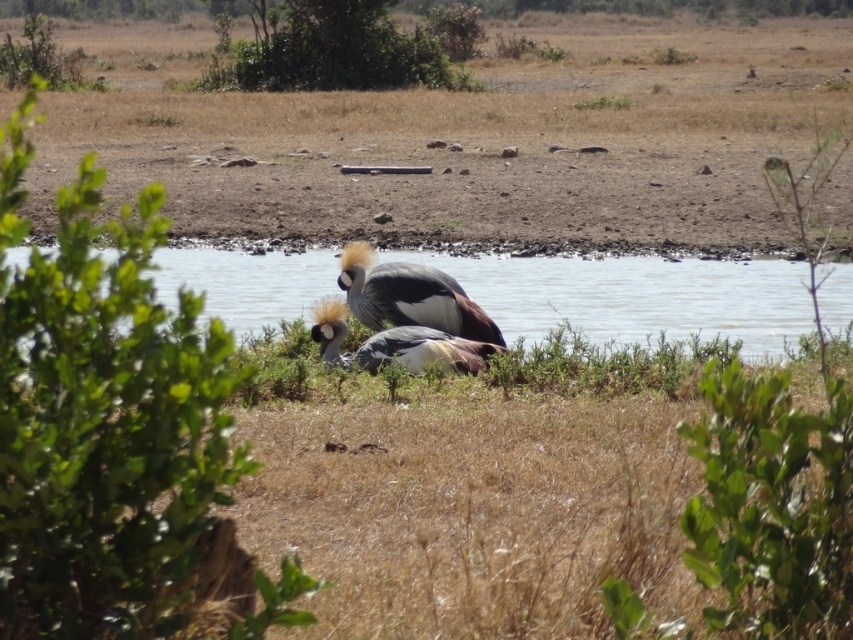
You are standing at the edge of the savanna and see the clear water at center. If you want to reach the water as quickly as possible, in which direction should you walk?

The clear water at center is located at point 0.464 on the x axis and 0.748 on the y axis. Since you are at the edge of the savanna, you should walk towards the center of the image to reach the clear water at center quickly.

You are a wildlife photographer aiming to capture a closeup shot of both the gray matte bird at center and the gray feathered bird at center. Your camera has a maximum focus range of 15 inches. Can you photograph both birds in the same frame without moving your position?

The gray matte bird at center and gray feathered bird at center are 15.12 inches apart. Since your camera can only focus within 15 inches, the distance between them exceeds the maximum focus range. Therefore, you cannot photograph both birds in the same frame without moving your position.

You are observing two birds in a savanna landscape. You see a gray matte bird at center and a gray feathered bird at center. Which one is positioned to the right of the other?

The gray matte bird at center is positioned to the right of the gray feathered bird at center.